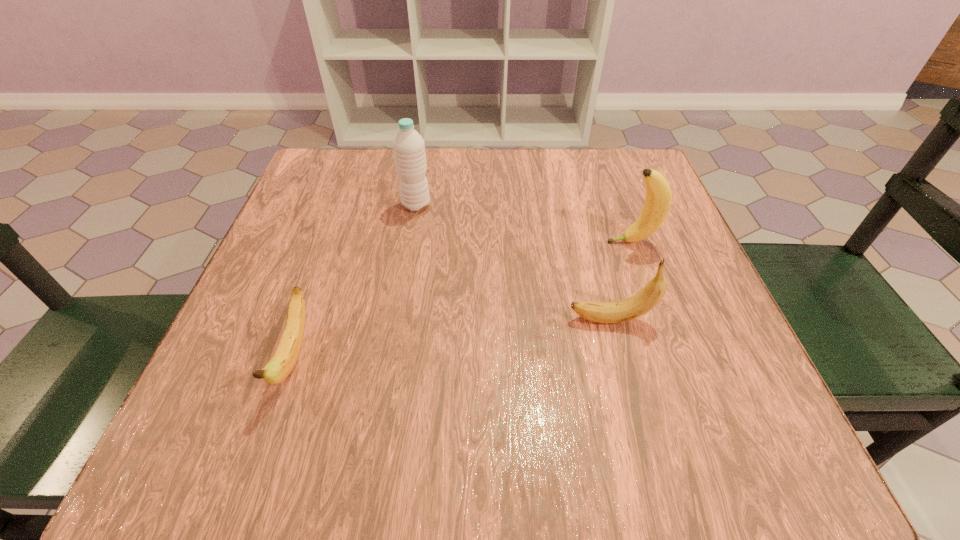
Locate an element on the screen. The height and width of the screenshot is (540, 960). free space between the farthest banana and the shortest object is located at coordinates (463, 299).

Locate an element on the screen. This screenshot has width=960, height=540. empty space that is in between the farthest banana and the leftmost banana is located at coordinates (463, 299).

You are a GUI agent. You are given a task and a screenshot of the screen. Output one action in this format:
    pyautogui.click(x=<x>, y=<y>)
    Task: Click on the free space between the second object from left to right and the third shortest object
    Image resolution: width=960 pixels, height=540 pixels.
    Given the screenshot: What is the action you would take?
    pyautogui.click(x=523, y=224)

Select which object is the second closest to the water bottle. Please provide its 2D coordinates. Your answer should be formatted as a tuple, i.e. [(x, y)], where the tuple contains the x and y coordinates of a point satisfying the conditions above.

[(658, 198)]

Locate which object ranks third in proximity to the farthest banana. Please provide its 2D coordinates. Your answer should be formatted as a tuple, i.e. [(x, y)], where the tuple contains the x and y coordinates of a point satisfying the conditions above.

[(282, 363)]

Select which banana is the second closest to the second tallest banana. Please provide its 2D coordinates. Your answer should be formatted as a tuple, i.e. [(x, y)], where the tuple contains the x and y coordinates of a point satisfying the conditions above.

[(282, 363)]

The image size is (960, 540). I want to click on the second closest banana relative to the farthest banana, so click(282, 363).

Image resolution: width=960 pixels, height=540 pixels. I want to click on vacant space that satisfies the following two spatial constraints: 1. at the start of the peel on the second tallest banana; 2. at the stem of the leftmost object, so click(x=621, y=356).

Locate an element on the screen. free space in the image that satisfies the following two spatial constraints: 1. from the stem of the farthest banana; 2. at the stem of the shortest object is located at coordinates (672, 356).

Where is `vacant space that satisfies the following two spatial constraints: 1. at the start of the peel on the third tallest object; 2. at the stem of the shortest banana`? This screenshot has width=960, height=540. vacant space that satisfies the following two spatial constraints: 1. at the start of the peel on the third tallest object; 2. at the stem of the shortest banana is located at coordinates (621, 356).